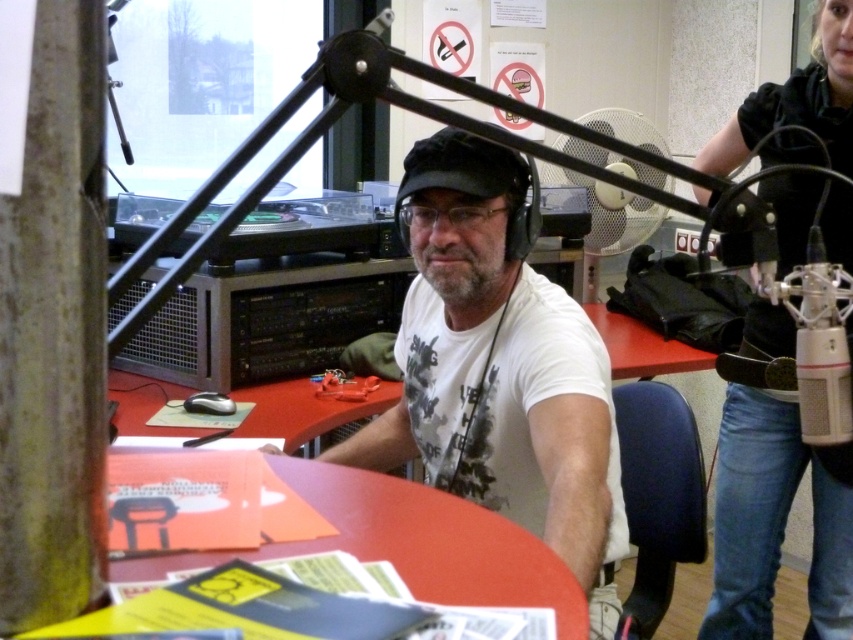
Question: Is white matte t-shirt at center above black leather jacket at upper right?

Choices:
 (A) no
 (B) yes

Answer: (A)

Question: Can you confirm if white matte t-shirt at center is positioned to the right of black leather jacket at upper right?

Choices:
 (A) yes
 (B) no

Answer: (B)

Question: Is white matte t-shirt at center to the left of black leather jacket at upper right from the viewer's perspective?

Choices:
 (A) yes
 (B) no

Answer: (A)